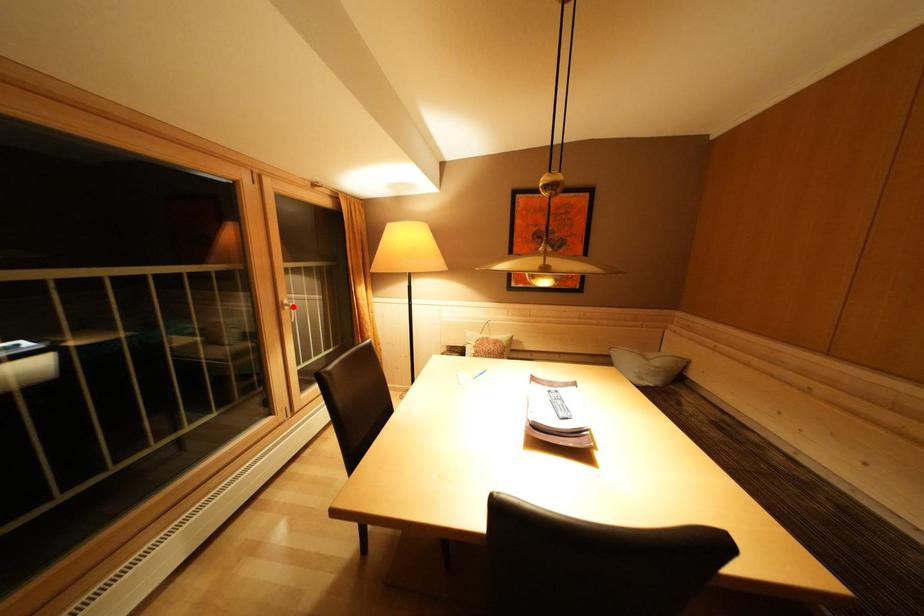
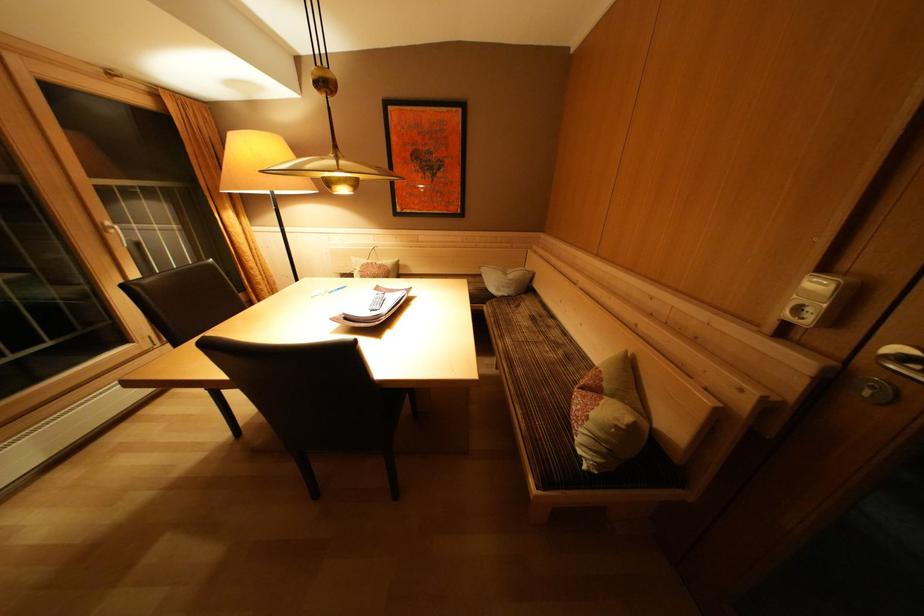
Locate, in the second image, the point that corresponds to the highlighted location in the first image.

(116, 229)